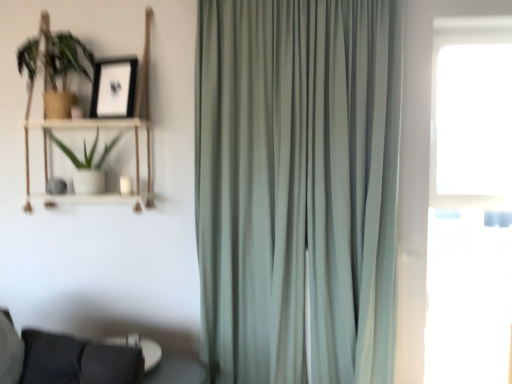
Question: Does woodenobject at left have a lesser height compared to satin green curtain at center?

Choices:
 (A) yes
 (B) no

Answer: (A)

Question: From a real-world perspective, is woodenobject at left over satin green curtain at center?

Choices:
 (A) no
 (B) yes

Answer: (B)

Question: Is woodenobject at left bigger than satin green curtain at center?

Choices:
 (A) yes
 (B) no

Answer: (B)

Question: Considering the relative sizes of woodenobject at left and satin green curtain at center in the image provided, is woodenobject at left taller than satin green curtain at center?

Choices:
 (A) no
 (B) yes

Answer: (A)

Question: Is woodenobject at left thinner than satin green curtain at center?

Choices:
 (A) no
 (B) yes

Answer: (B)

Question: Is woodenobject at left placed right next to satin green curtain at center?

Choices:
 (A) no
 (B) yes

Answer: (A)

Question: From the image's perspective, does white matte pot at left, marked as the 2th houseplant in a top-to-bottom arrangement, appear lower than black matte picture frame at upper left?

Choices:
 (A) no
 (B) yes

Answer: (B)

Question: Would you say white matte pot at left, marked as the 2th houseplant in a top-to-bottom arrangement, contains black matte picture frame at upper left?

Choices:
 (A) no
 (B) yes

Answer: (A)

Question: From a real-world perspective, is white matte pot at left, marked as the 2th houseplant in a top-to-bottom arrangement, on black matte picture frame at upper left?

Choices:
 (A) no
 (B) yes

Answer: (A)

Question: Considering the relative sizes of white matte pot at left, the first houseplant ordered from the bottom, and black matte picture frame at upper left in the image provided, is white matte pot at left, the first houseplant ordered from the bottom, thinner than black matte picture frame at upper left?

Choices:
 (A) yes
 (B) no

Answer: (B)

Question: Is white matte pot at left, marked as the 2th houseplant in a top-to-bottom arrangement, shorter than black matte picture frame at upper left?

Choices:
 (A) yes
 (B) no

Answer: (B)

Question: Does white matte pot at left, marked as the 2th houseplant in a top-to-bottom arrangement, touch black matte picture frame at upper left?

Choices:
 (A) yes
 (B) no

Answer: (B)

Question: From a real-world perspective, is white matte pot at left, marked as the 2th houseplant in a top-to-bottom arrangement, physically below green matte plant at upper left, the first houseplant from the top?

Choices:
 (A) yes
 (B) no

Answer: (A)